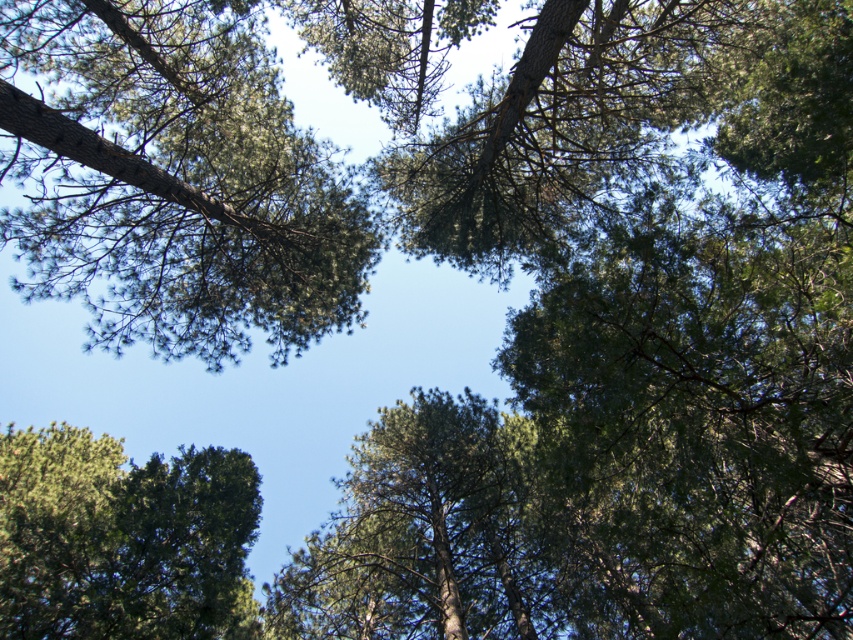
Does green textured tree at upper left have a smaller size compared to green textured tree at lower left?

Yes.

Is green textured tree at upper left shorter than green textured tree at lower left?

Yes.

Who is more forward, (74, 172) or (50, 538)?

Point (50, 538)

Identify the location of green textured tree at upper left. (172, 179).